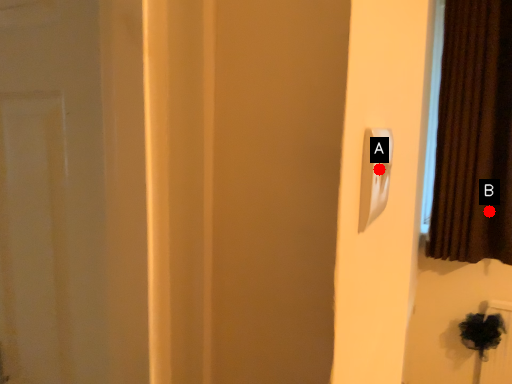
Question: Two points are circled on the image, labeled by A and B beside each circle. Which point is closer to the camera?

Choices:
 (A) A is closer
 (B) B is closer

Answer: (A)